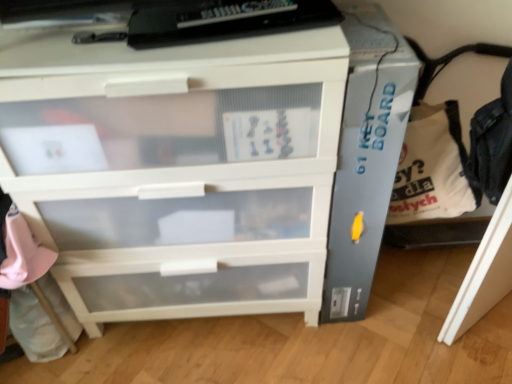
Locate an element on the screen. The height and width of the screenshot is (384, 512). free point above gray plastic file cabinet at right (from a real-world perspective) is located at coordinates (361, 25).